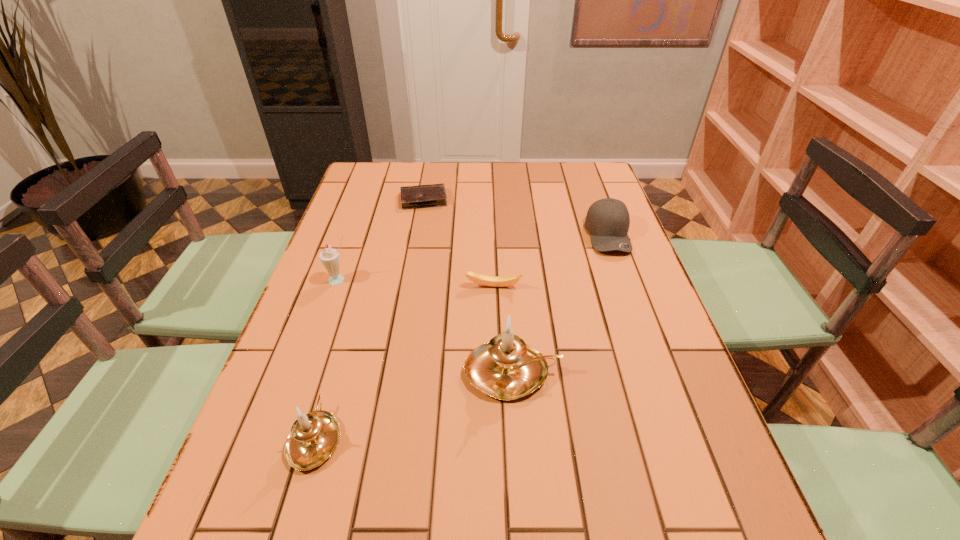
Where is `the nearest object`? the nearest object is located at coordinates (313, 438).

This screenshot has height=540, width=960. In order to click on the nearer candle holder in this screenshot , I will do tap(313, 438).

Image resolution: width=960 pixels, height=540 pixels. In order to click on the fifth farthest object in this screenshot , I will do `click(506, 368)`.

Find the location of `the tallest object`. the tallest object is located at coordinates (506, 368).

Identify the location of diary. This screenshot has width=960, height=540. (434, 195).

Locate an element on the screen. The height and width of the screenshot is (540, 960). the shortest object is located at coordinates (434, 195).

Identify the location of baseball cap. This screenshot has height=540, width=960. (607, 220).

Locate an element on the screen. The image size is (960, 540). the rightmost object is located at coordinates (607, 220).

At what (x,y) coordinates should I click in order to perform the action: click on milkshake. Please return your answer as a coordinate pair (x, y). The height and width of the screenshot is (540, 960). Looking at the image, I should click on (330, 258).

You are a GUI agent. You are given a task and a screenshot of the screen. Output one action in this format:
    pyautogui.click(x=<x>, y=<y>)
    Task: Click on the banana
    Image resolution: width=960 pixels, height=540 pixels.
    Given the screenshot: What is the action you would take?
    pyautogui.click(x=493, y=281)